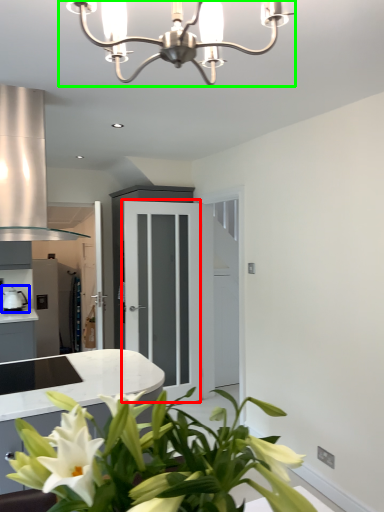
Question: Considering the real-world distances, which object is closest to glass door (highlighted by a red box)? appliance (highlighted by a blue box) or lamp (highlighted by a green box).

Choices:
 (A) appliance
 (B) lamp

Answer: (A)